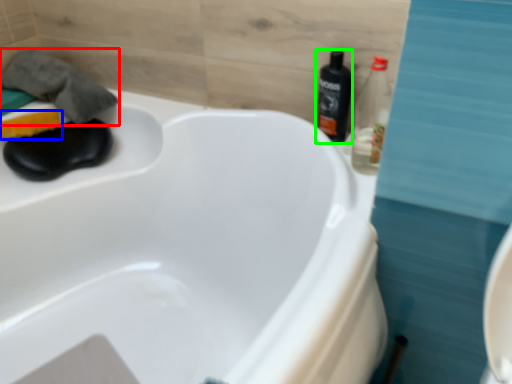
Question: Considering the real-world distances, which object is farthest from bath towel (highlighted by a red box)? soap (highlighted by a blue box) or bottle (highlighted by a green box)?

Choices:
 (A) soap
 (B) bottle

Answer: (B)